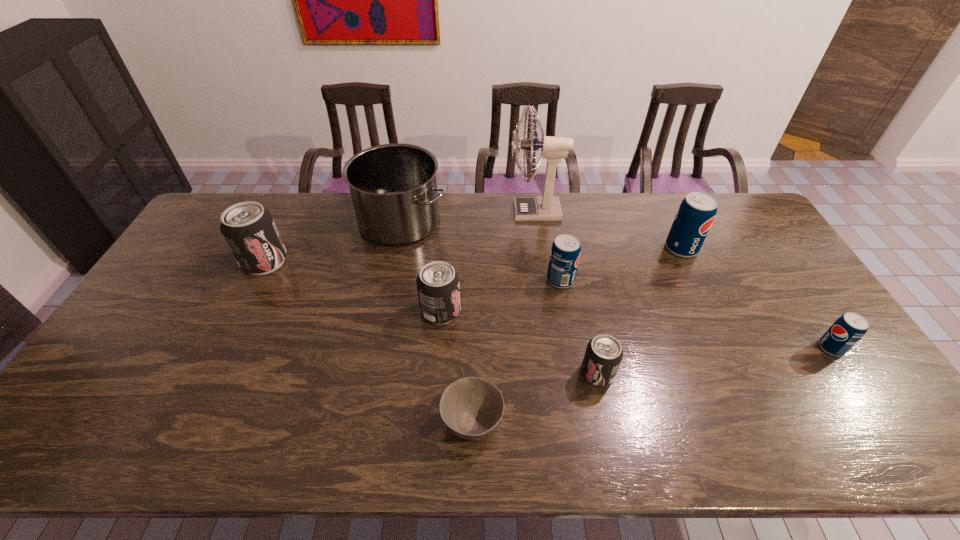
Where is `vacant space situated on the front of the saucepan`? The image size is (960, 540). vacant space situated on the front of the saucepan is located at coordinates (380, 319).

The width and height of the screenshot is (960, 540). In order to click on vacant space located on the left of the second object from right to left in this screenshot , I will do `click(569, 248)`.

Image resolution: width=960 pixels, height=540 pixels. I want to click on free region located on the back of the leftmost object, so click(x=292, y=205).

This screenshot has width=960, height=540. I want to click on vacant space located 0.360m on the back of the leftmost blue pop, so click(x=547, y=202).

In order to click on free space located on the left of the second biggest black soda can in this screenshot , I will do `click(328, 311)`.

I want to click on blank area located on the back of the rightmost blue pop, so click(804, 308).

Find the location of `free space located on the back of the smallest black soda can`. free space located on the back of the smallest black soda can is located at coordinates (587, 320).

This screenshot has width=960, height=540. Identify the location of vacant space located 0.060m on the back of the shortest object. (473, 374).

Where is `fan that is positioned at the far edge`? fan that is positioned at the far edge is located at coordinates (546, 208).

This screenshot has width=960, height=540. What are the coordinates of `saucepan that is at the far edge` in the screenshot? It's located at (393, 187).